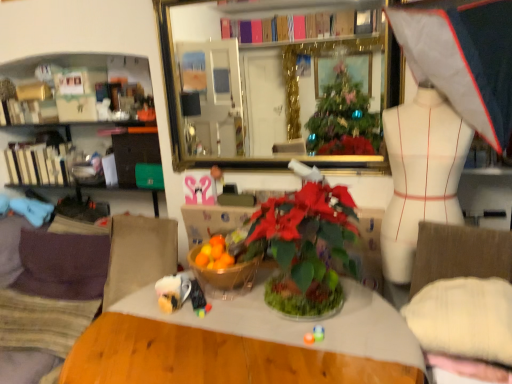
Question: From a real-world perspective, is gold-framed mirror at upper center above or below white fabric umbrella at upper right?

Choices:
 (A) below
 (B) above

Answer: (A)

Question: Considering the positions of gold-framed mirror at upper center and white fabric umbrella at upper right in the image, is gold-framed mirror at upper center wider or thinner than white fabric umbrella at upper right?

Choices:
 (A) thin
 (B) wide

Answer: (A)

Question: Which is nearer to the translucent glass bowl at center?

Choices:
 (A) gold-framed mirror at upper center
 (B) green glossy houseplant at center
 (C) suede-like beige couch at lower left
 (D) white matte mannequin at right
 (E) white fabric umbrella at upper right

Answer: (B)

Question: Estimate the real-world distances between objects in this image. Which object is closer to the white matte mannequin at right?

Choices:
 (A) suede-like beige couch at lower left
 (B) gold-framed mirror at upper center
 (C) green glossy houseplant at center
 (D) white fabric umbrella at upper right
 (E) translucent glass bowl at center

Answer: (D)